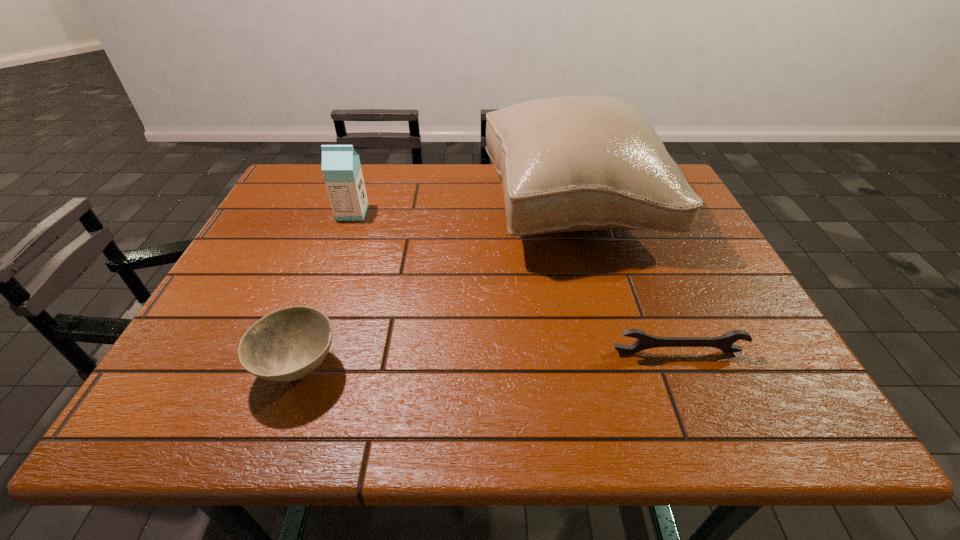
Where is `unoccupied position between the cushion and the milk carton`? This screenshot has height=540, width=960. unoccupied position between the cushion and the milk carton is located at coordinates (463, 211).

Where is `vacant area that lies between the second tallest object and the third tallest object`? The image size is (960, 540). vacant area that lies between the second tallest object and the third tallest object is located at coordinates (325, 290).

Image resolution: width=960 pixels, height=540 pixels. What are the coordinates of `empty space between the wrench and the second shortest object` in the screenshot? It's located at (489, 360).

You are a GUI agent. You are given a task and a screenshot of the screen. Output one action in this format:
    pyautogui.click(x=<x>, y=<y>)
    Task: Click on the vacant area that lies between the shortest object and the cushion
    
    Given the screenshot: What is the action you would take?
    pyautogui.click(x=625, y=280)

The height and width of the screenshot is (540, 960). Identify the location of empty location between the cushion and the milk carton. (463, 211).

In order to click on vacant area that lies between the milk carton and the tallest object in this screenshot , I will do `click(463, 211)`.

You are a GUI agent. You are given a task and a screenshot of the screen. Output one action in this format:
    pyautogui.click(x=<x>, y=<y>)
    Task: Click on the vacant space in between the bowl and the cushion
    
    Given the screenshot: What is the action you would take?
    pyautogui.click(x=436, y=288)

Find the location of a particular element. This screenshot has height=540, width=960. unoccupied area between the cushion and the third shortest object is located at coordinates (463, 211).

You are a GUI agent. You are given a task and a screenshot of the screen. Output one action in this format:
    pyautogui.click(x=<x>, y=<y>)
    Task: Click on the free area in between the wrench and the cushion
    The height and width of the screenshot is (540, 960).
    Given the screenshot: What is the action you would take?
    pyautogui.click(x=625, y=280)

Where is `free space that is in between the bowl and the second tallest object`? This screenshot has width=960, height=540. free space that is in between the bowl and the second tallest object is located at coordinates (325, 290).